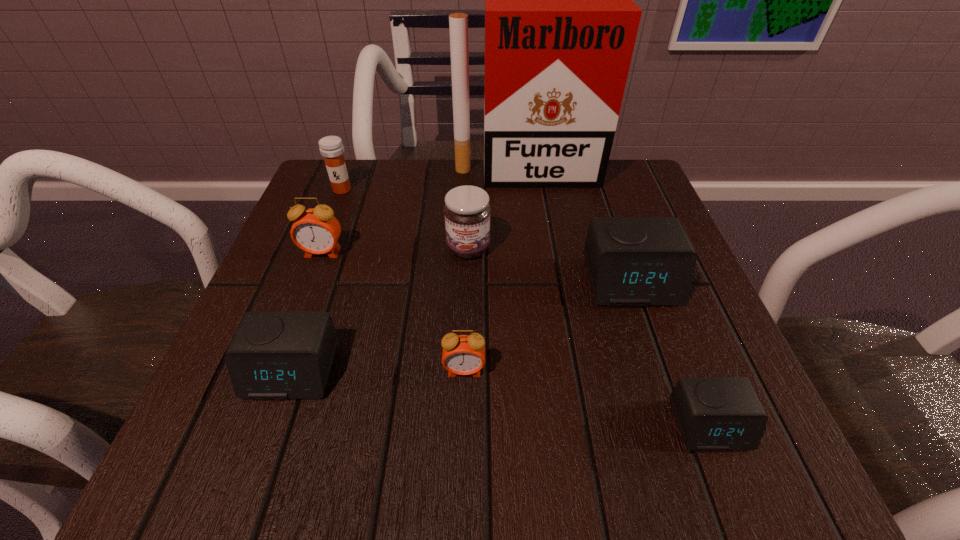
Image resolution: width=960 pixels, height=540 pixels. In order to click on medicine located at the far edge in this screenshot , I will do `click(331, 148)`.

The width and height of the screenshot is (960, 540). What are the coordinates of `object that is at the near edge` in the screenshot? It's located at (713, 413).

The image size is (960, 540). What are the coordinates of `medicine that is at the left edge` in the screenshot? It's located at (331, 148).

At what (x,y) coordinates should I click in order to perform the action: click on cigarette case present at the right edge. Please return your answer as a coordinate pair (x, y). Looking at the image, I should click on (560, 23).

Identify the location of object situated at the far left corner. (331, 148).

Find the location of a particular element. The height and width of the screenshot is (540, 960). object at the far right corner is located at coordinates (560, 23).

The image size is (960, 540). I want to click on object present at the near right corner, so (x=713, y=413).

Where is `free region at the far edge`? free region at the far edge is located at coordinates (383, 206).

You are a GUI agent. You are given a task and a screenshot of the screen. Output one action in this format:
    pyautogui.click(x=<x>, y=<y>)
    Task: Click on the free space at the near edge
    
    Given the screenshot: What is the action you would take?
    pyautogui.click(x=415, y=419)

Locate an element on the screen. The image size is (960, 540). free space at the left edge is located at coordinates (356, 225).